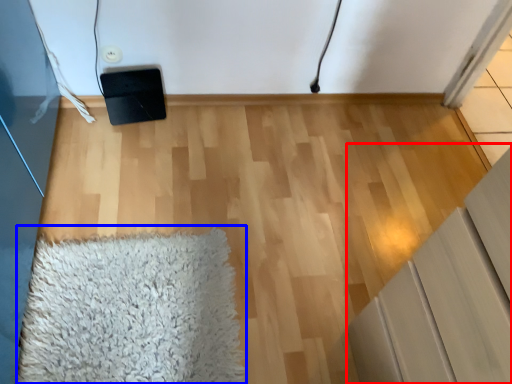
Question: Which point is further to the camera, furniture (highlighted by a red box) or mat (highlighted by a blue box)?

Choices:
 (A) furniture
 (B) mat

Answer: (B)